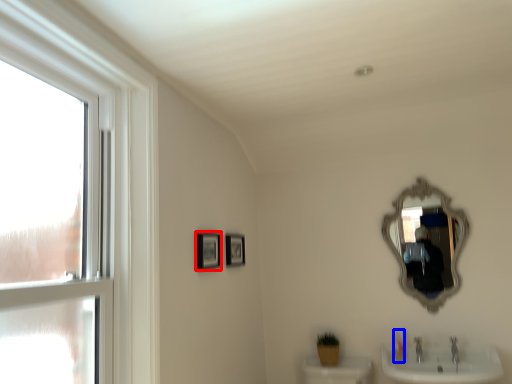
Question: Which object is closer to the camera taking this photo, picture frame (highlighted by a red box) or toiletry (highlighted by a blue box)?

Choices:
 (A) picture frame
 (B) toiletry

Answer: (A)